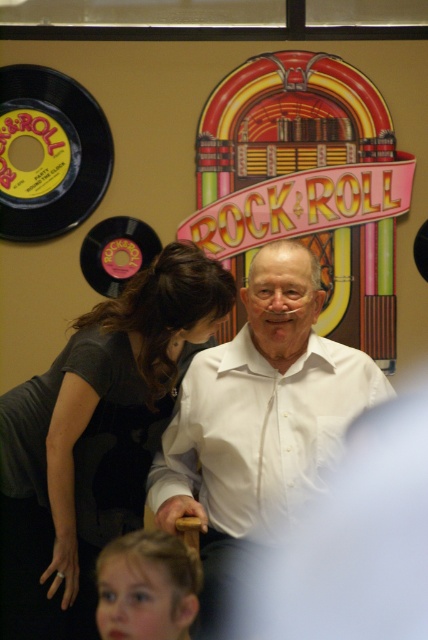
Question: Among these points, which one is farthest from the camera?

Choices:
 (A) pos(255,490)
 (B) pos(192,563)

Answer: (A)

Question: Among these objects, which one is nearest to the camera?

Choices:
 (A) dark gray shirt at center
 (B) white smooth shirt at center
 (C) blonde hair at lower left

Answer: (C)

Question: Is dark gray shirt at center behind blonde hair at lower left?

Choices:
 (A) no
 (B) yes

Answer: (B)

Question: Does dark gray shirt at center have a greater width compared to white smooth shirt at center?

Choices:
 (A) no
 (B) yes

Answer: (A)

Question: Does white smooth shirt at center come in front of blonde hair at lower left?

Choices:
 (A) no
 (B) yes

Answer: (A)

Question: Which object appears farthest from the camera in this image?

Choices:
 (A) white smooth shirt at center
 (B) dark gray shirt at center
 (C) blonde hair at lower left

Answer: (B)